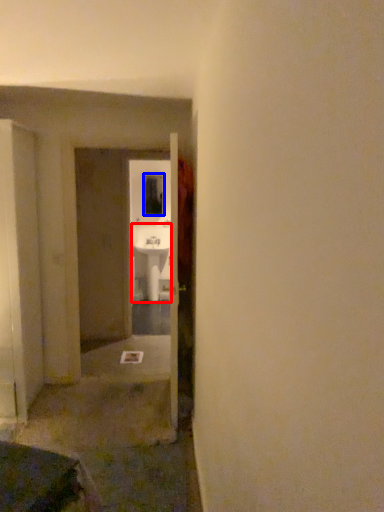
Question: Among these objects, which one is farthest to the camera, sink (highlighted by a red box) or window (highlighted by a blue box)?

Choices:
 (A) sink
 (B) window

Answer: (B)